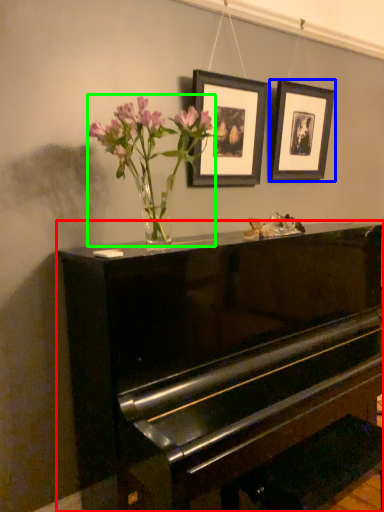
Question: Which is nearer to the piano (highlighted by a red box)? picture frame (highlighted by a blue box) or floral arrangement (highlighted by a green box).

Choices:
 (A) picture frame
 (B) floral arrangement

Answer: (B)